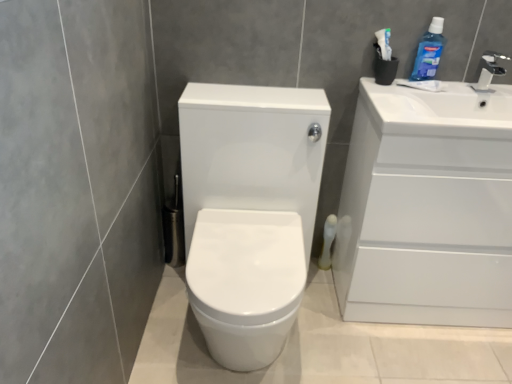
Question: From their relative heights in the image, would you say white matte toilet paper at lower right is taller or shorter than blue glossy mouthwash at upper right?

Choices:
 (A) short
 (B) tall

Answer: (B)

Question: Based on their positions, is white matte toilet paper at lower right located to the left or right of blue glossy mouthwash at upper right?

Choices:
 (A) right
 (B) left

Answer: (B)

Question: Which object is the farthest from the white glossy faucet at upper right?

Choices:
 (A) white glossy toilet at center
 (B) white matte toilet paper at lower right
 (C) white glossy cabinet at right
 (D) blue glossy mouthwash at upper right

Answer: (A)

Question: Which of these objects is positioned farthest from the white glossy cabinet at right?

Choices:
 (A) white matte toilet paper at lower right
 (B) white glossy faucet at upper right
 (C) white glossy toilet at center
 (D) blue glossy mouthwash at upper right

Answer: (A)